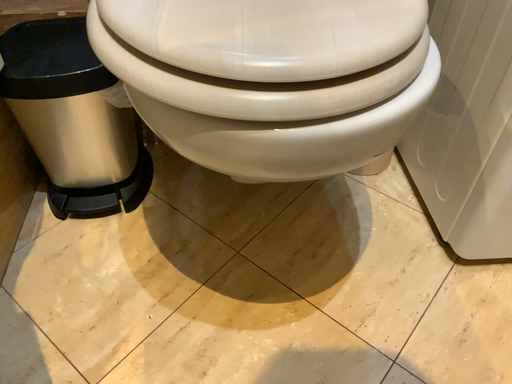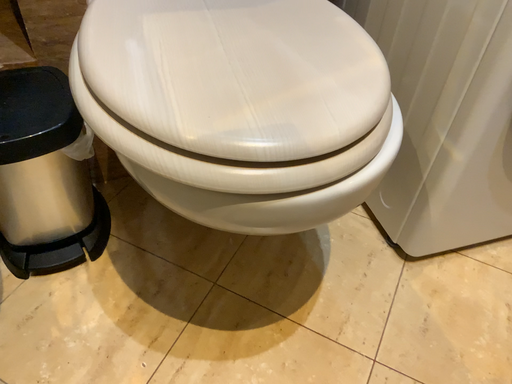
Question: Which way did the camera rotate in the video?

Choices:
 (A) rotated right
 (B) rotated left

Answer: (A)